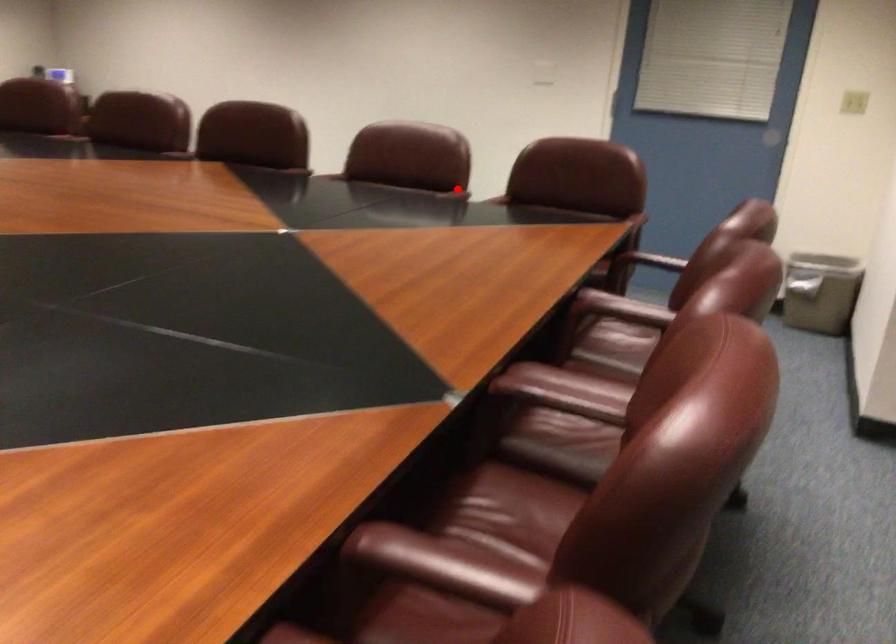
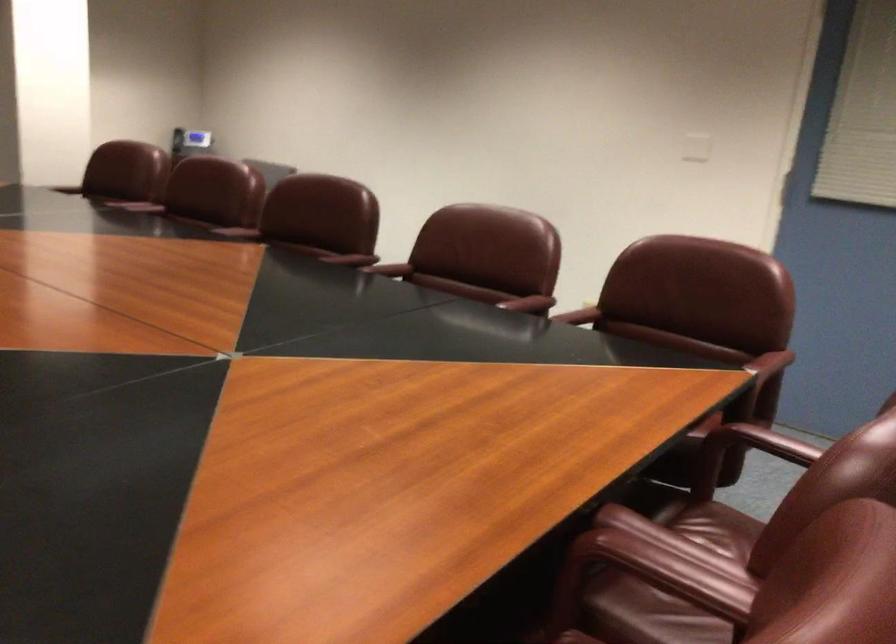
Question: I am providing you with two images of the same scene from different viewpoints. Image1 has a red point marked. In image2, the corresponding 3D location appears at what relative position? Reply with the corresponding letter.

Choices:
 (A) Closer
 (B) Farther

Answer: (A)